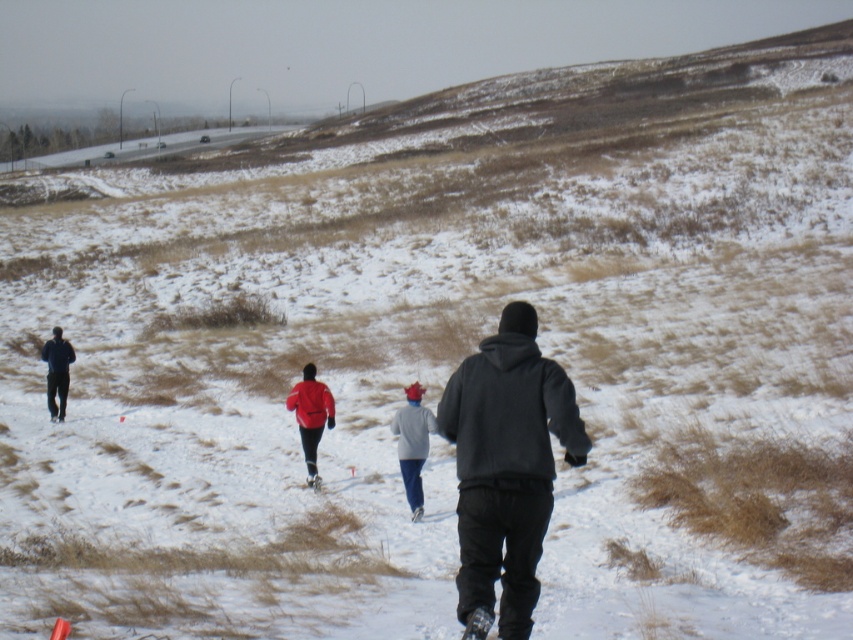
Does dark blue jacket at left lie behind white matte ski at center?

Yes, it is.

Based on the photo, which of these two, dark blue jacket at left or white matte ski at center, stands shorter?

white matte ski at center is shorter.

What do you see at coordinates (57, 371) in the screenshot? This screenshot has width=853, height=640. I see `dark blue jacket at left` at bounding box center [57, 371].

Identify the location of dark blue jacket at left. Image resolution: width=853 pixels, height=640 pixels. (57, 371).

Is gray fleece jacket at center smaller than matte red jacket at center?

Incorrect, gray fleece jacket at center is not smaller in size than matte red jacket at center.

Is gray fleece jacket at center closer to the viewer compared to matte red jacket at center?

That is True.

Find the location of a particular element. The width and height of the screenshot is (853, 640). gray fleece jacket at center is located at coordinates (412, 444).

Locate an element on the screen. The width and height of the screenshot is (853, 640). gray fleece jacket at center is located at coordinates point(412,444).

Does dark gray hoodie at center appear over gray fleece jacket at center?

Yes.

Is dark gray hoodie at center positioned at the back of gray fleece jacket at center?

No, it is in front of gray fleece jacket at center.

Which is in front, point (540, 355) or point (407, 492)?

Point (540, 355)

The width and height of the screenshot is (853, 640). I want to click on dark gray hoodie at center, so click(x=506, y=467).